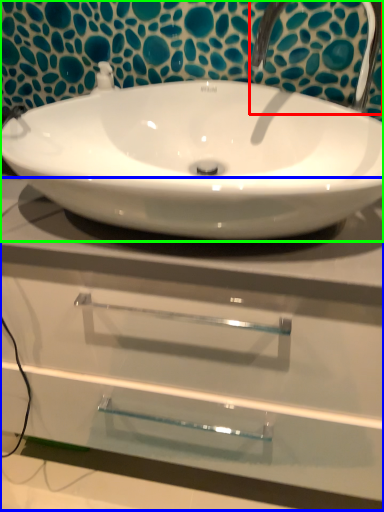
Question: Estimate the real-world distances between objects in this image. Which object is closer to plumbing fixture (highlighted by a red box), counter top (highlighted by a blue box) or sink (highlighted by a green box)?

Choices:
 (A) counter top
 (B) sink

Answer: (B)